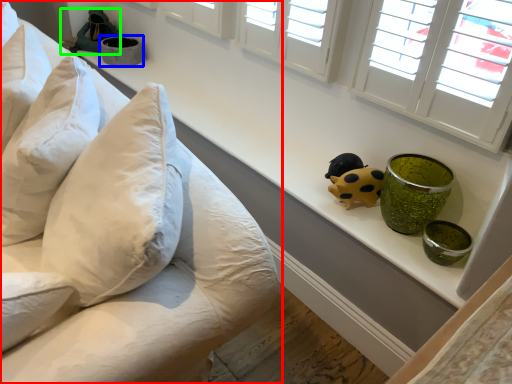
Question: Considering the real-world distances, which object is farthest from furniture (highlighted by a red box)? glass bowl (highlighted by a blue box) or toy (highlighted by a green box)?

Choices:
 (A) glass bowl
 (B) toy

Answer: (B)